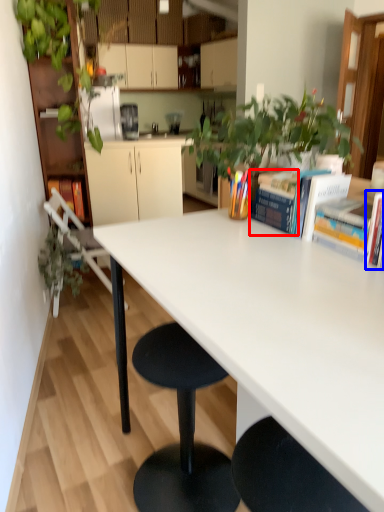
Question: Which object is further to the camera taking this photo, book (highlighted by a red box) or book (highlighted by a blue box)?

Choices:
 (A) book
 (B) book

Answer: (A)